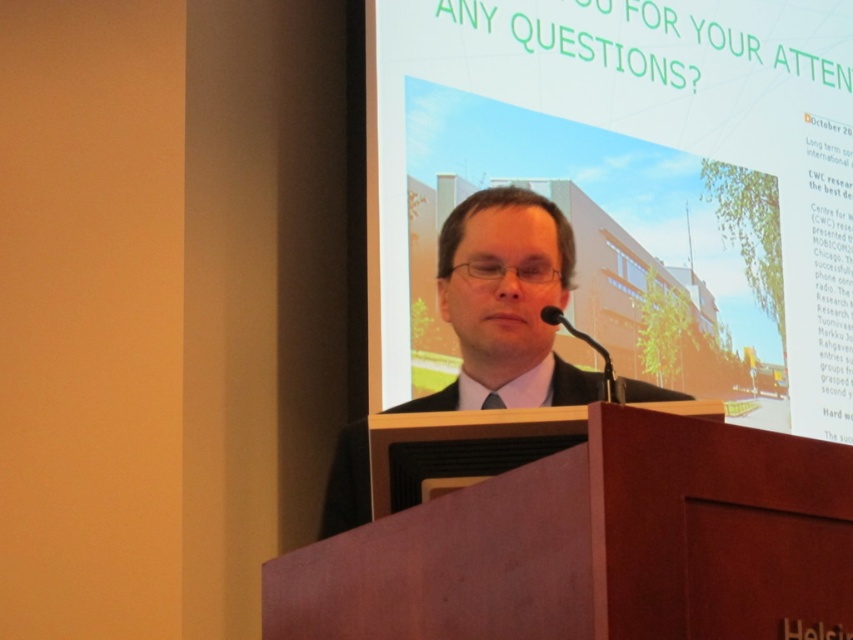
You are a photographer trying to capture a closeup of the man speaking at the podium. You notice two points marked in the scene. Which point, point 1 at coordinates [368,465] or point 2 at [496,403], is closer to your camera lens?

Point 1 at coordinates [368,465] is closer to the camera lens than point 2 at [496,403].

You are an attendee at the presentation. You want to ask the presenter a question but need to raise your hand first. Since the presenter is facing the screen, you need to make sure your hand is visible to them. Given the positions of the brown wood podium at center and the black suit at center, where should you raise your hand to ensure it is visible to the presenter?

The brown wood podium at center is located below the black suit at center. To ensure your hand is visible to the presenter, raise it above the podium so it is above the black suit at center, making it clearly visible to the presenter facing the screen.

From the picture: You are an event organizer who needs to adjust the microphone height for the speaker. Considering the brown wood podium at center and the black satin tie at center, which object should you focus on to ensure the microphone is positioned correctly for the speaker?

The brown wood podium at center has a greater height compared to the black satin tie at center, so you should adjust the microphone height based on the brown wood podium at center to ensure it is at the right level for the speaker.